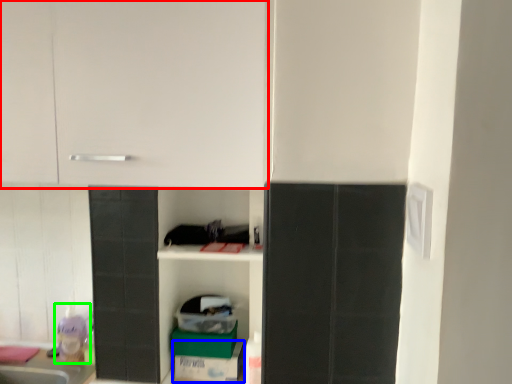
Question: Which object is the farthest from cabinetry (highlighted by a red box)? Choose among these: cardboard box (highlighted by a blue box) or toy (highlighted by a green box).

Choices:
 (A) cardboard box
 (B) toy

Answer: (B)